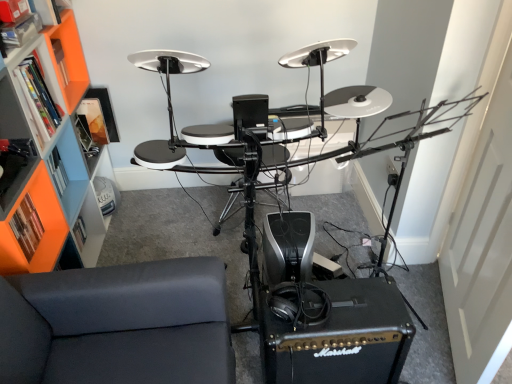
Question: Can you confirm if orange matte bookshelf at left, which is the 2th shelf from top to bottom, is bigger than orange plastic bookshelf at left?

Choices:
 (A) no
 (B) yes

Answer: (A)

Question: From a real-world perspective, is orange matte bookshelf at left, which is the first shelf from bottom to top, positioned over orange plastic bookshelf at left based on gravity?

Choices:
 (A) yes
 (B) no

Answer: (B)

Question: Is orange matte bookshelf at left, which is the 2th shelf from top to bottom, to the right of orange plastic bookshelf at left from the viewer's perspective?

Choices:
 (A) yes
 (B) no

Answer: (A)

Question: Does orange matte bookshelf at left, which is the 2th shelf from top to bottom, have a greater height compared to orange plastic bookshelf at left?

Choices:
 (A) yes
 (B) no

Answer: (B)

Question: From a real-world perspective, is orange matte bookshelf at left, which is the first shelf from bottom to top, under orange plastic bookshelf at left?

Choices:
 (A) no
 (B) yes

Answer: (B)

Question: Is orange matte bookshelf at left, which is the first shelf from bottom to top, to the left or to the right of orange plastic shelf at left, marked as the 1th shelf in a top-to-bottom arrangement, in the image?

Choices:
 (A) right
 (B) left

Answer: (B)

Question: From a real-world perspective, is orange matte bookshelf at left, which is the first shelf from bottom to top, above or below orange plastic shelf at left, which ranks as the second shelf in bottom-to-top order?

Choices:
 (A) below
 (B) above

Answer: (A)

Question: From the image's perspective, is orange matte bookshelf at left, which is the first shelf from bottom to top, above or below orange plastic shelf at left, marked as the 1th shelf in a top-to-bottom arrangement?

Choices:
 (A) above
 (B) below

Answer: (B)

Question: Looking at their shapes, would you say orange matte bookshelf at left, which is the 2th shelf from top to bottom, is wider or thinner than orange plastic shelf at left, which ranks as the second shelf in bottom-to-top order?

Choices:
 (A) thin
 (B) wide

Answer: (A)

Question: From a real-world perspective, is orange plastic shelf at left, which ranks as the second shelf in bottom-to-top order, positioned above or below orange matte bookshelf at left, which is the first shelf from bottom to top?

Choices:
 (A) above
 (B) below

Answer: (A)

Question: In the image, is orange plastic shelf at left, marked as the 1th shelf in a top-to-bottom arrangement, on the left side or the right side of orange matte bookshelf at left, which is the first shelf from bottom to top?

Choices:
 (A) left
 (B) right

Answer: (B)

Question: Which is correct: orange plastic shelf at left, which ranks as the second shelf in bottom-to-top order, is inside orange matte bookshelf at left, which is the first shelf from bottom to top, or outside of it?

Choices:
 (A) outside
 (B) inside

Answer: (A)

Question: Is orange plastic shelf at left, which ranks as the second shelf in bottom-to-top order, bigger or smaller than orange matte bookshelf at left, which is the first shelf from bottom to top?

Choices:
 (A) big
 (B) small

Answer: (A)

Question: Is orange matte bookshelf at left, which is the first shelf from bottom to top, wider or thinner than orange plastic bookshelf at left?

Choices:
 (A) thin
 (B) wide

Answer: (A)

Question: From a real-world perspective, is orange matte bookshelf at left, which is the first shelf from bottom to top, positioned above or below orange plastic bookshelf at left?

Choices:
 (A) above
 (B) below

Answer: (B)